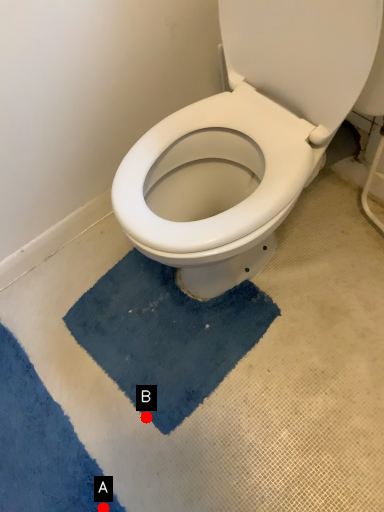
Question: Two points are circled on the image, labeled by A and B beside each circle. Which point appears farthest from the camera in this image?

Choices:
 (A) A is further
 (B) B is further

Answer: (B)